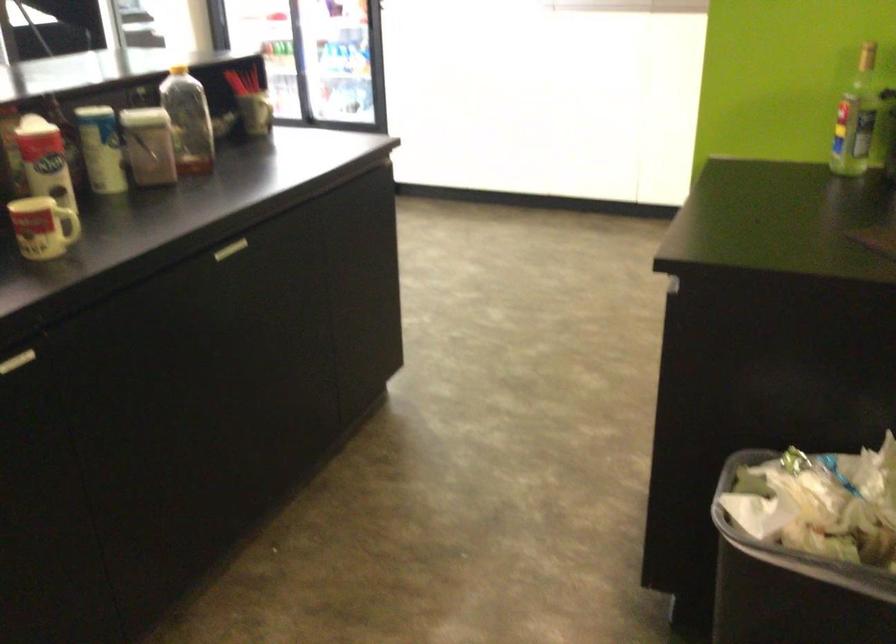
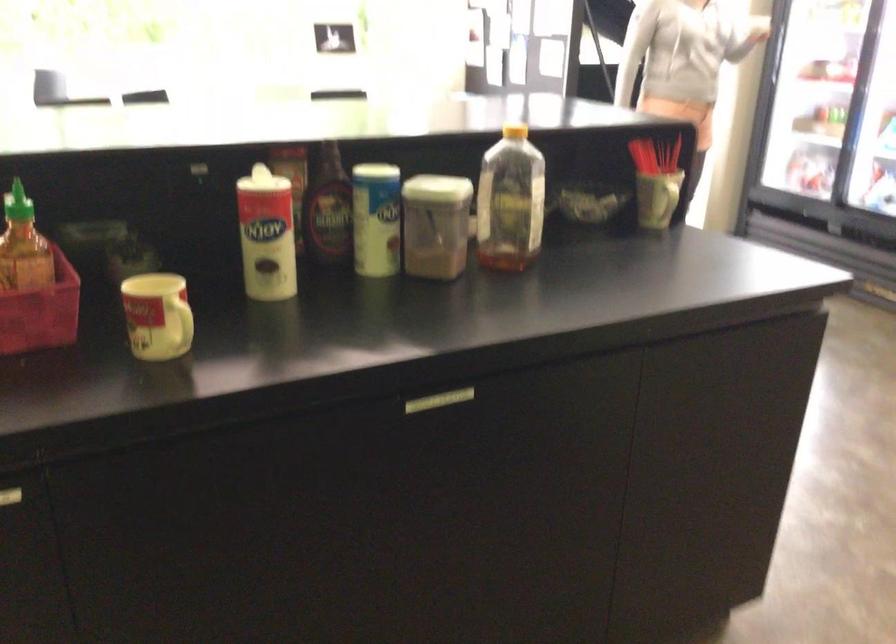
Question: The camera is either moving clockwise (left) or counter-clockwise (right) around the object. The first image is from the beginning of the video and the second image is from the end. Is the camera moving left or right when shooting the video?

Choices:
 (A) Left
 (B) Right

Answer: (B)